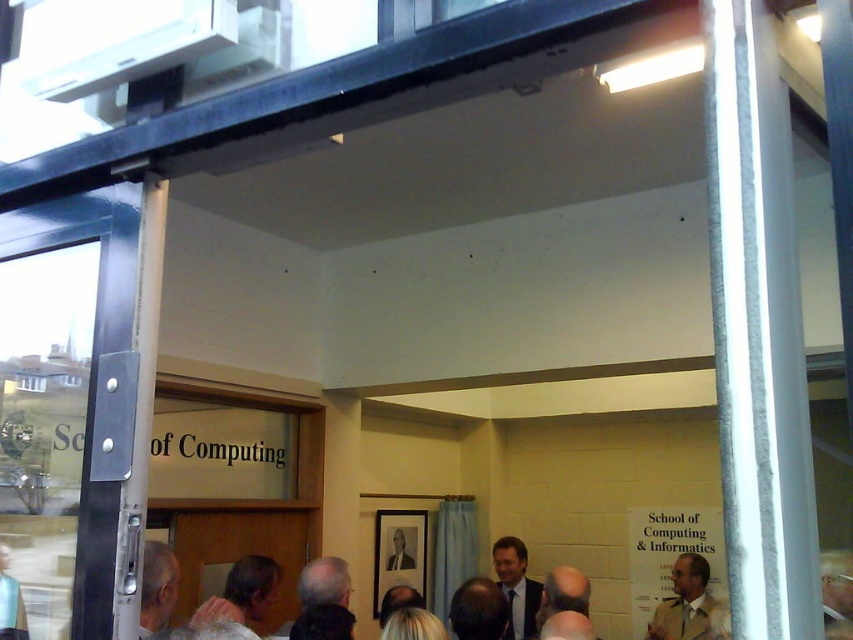
Is gray hair at center smaller than light brown suit at center?

No.

Does gray hair at center appear on the right side of light brown suit at center?

Incorrect, gray hair at center is not on the right side of light brown suit at center.

The width and height of the screenshot is (853, 640). What do you see at coordinates (241, 593) in the screenshot?
I see `gray hair at center` at bounding box center [241, 593].

The width and height of the screenshot is (853, 640). Identify the location of gray hair at center. [241, 593].

Does matte black suit at center have a greater height compared to light brown leather jacket at lower right?

Yes, matte black suit at center is taller than light brown leather jacket at lower right.

Between matte black suit at center and light brown leather jacket at lower right, which one is positioned lower?

Positioned lower is matte black suit at center.

Who is more forward, (502, 560) or (828, 556)?

Point (828, 556) is in front.

At what (x,y) coordinates should I click in order to perform the action: click on matte black suit at center. Please return your answer as a coordinate pair (x, y). The width and height of the screenshot is (853, 640). Looking at the image, I should click on (515, 588).

Does light brown suit at center lie in front of dark gray suit at lower left?

Yes, it is.

How far apart are light brown suit at center and dark gray suit at lower left?

They are 21.17 inches apart.

Between point (500, 636) and point (323, 557), which one is positioned behind?

The point (323, 557) is behind.

This screenshot has height=640, width=853. Identify the location of light brown suit at center. (479, 609).